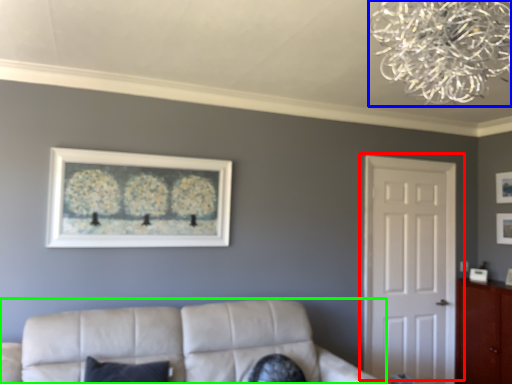
Question: Estimate the real-world distances between objects in this image. Which object is closer to door (highlighted by a red box), lamp (highlighted by a blue box) or studio couch (highlighted by a green box)?

Choices:
 (A) lamp
 (B) studio couch

Answer: (B)